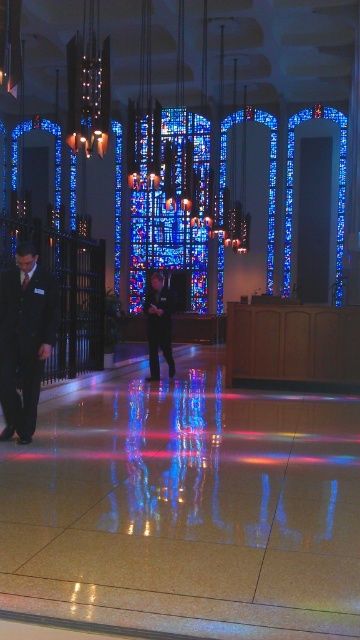
Question: Where is dark blue suit at left located in relation to dark blue suit at center in the image?

Choices:
 (A) right
 (B) left

Answer: (B)

Question: From the image, what is the correct spatial relationship of dark blue suit at left in relation to dark blue suit at center?

Choices:
 (A) below
 (B) above

Answer: (A)

Question: Among these objects, which one is nearest to the camera?

Choices:
 (A) dark blue suit at center
 (B) dark blue suit at left

Answer: (B)

Question: Which point is closer to the camera?

Choices:
 (A) dark blue suit at center
 (B) dark blue suit at left

Answer: (B)

Question: Is dark blue suit at left positioned in front of dark blue suit at center?

Choices:
 (A) yes
 (B) no

Answer: (A)

Question: Which point is closer to the camera?

Choices:
 (A) dark blue suit at center
 (B) dark blue suit at left

Answer: (B)